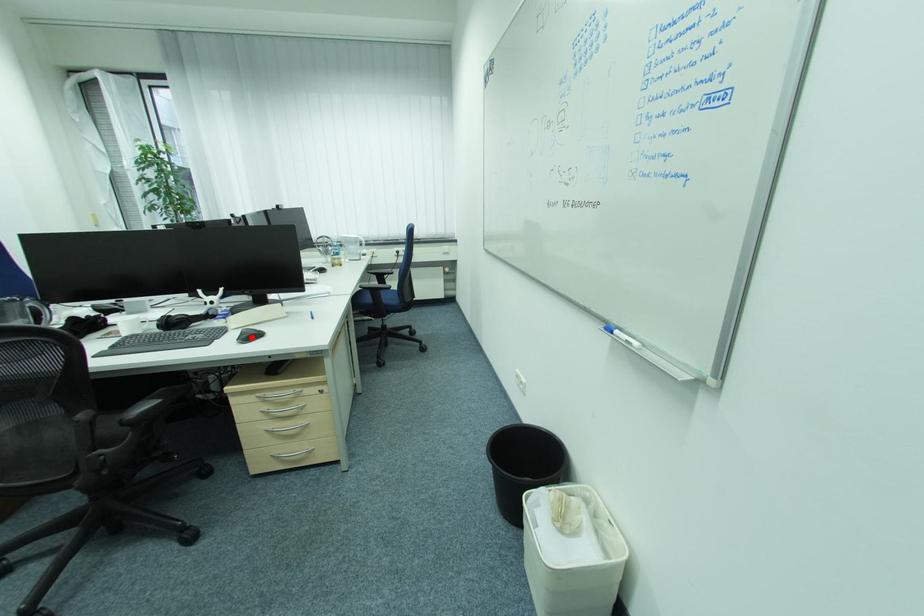
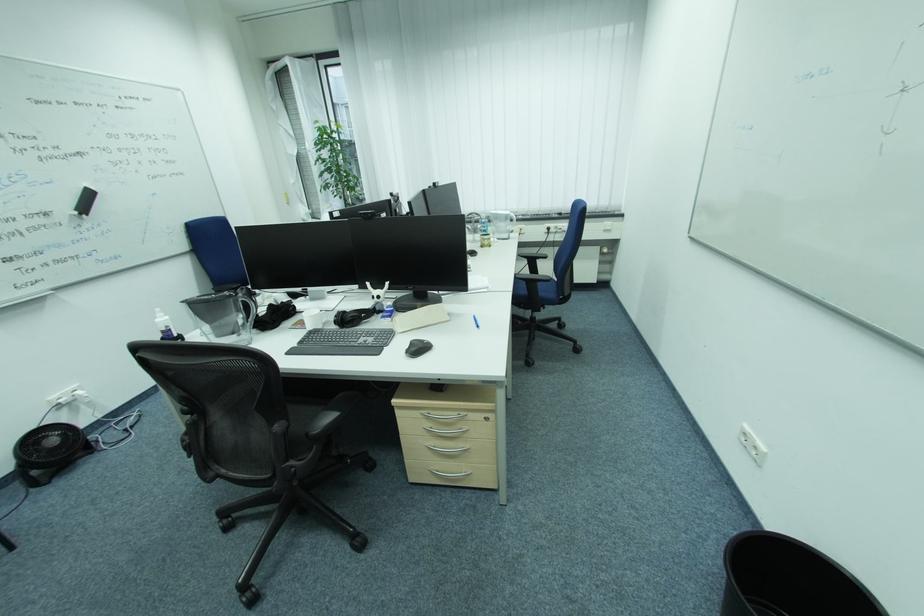
The point at the highlighted location is marked in the first image. Where is the corresponding point in the second image?

(419, 350)